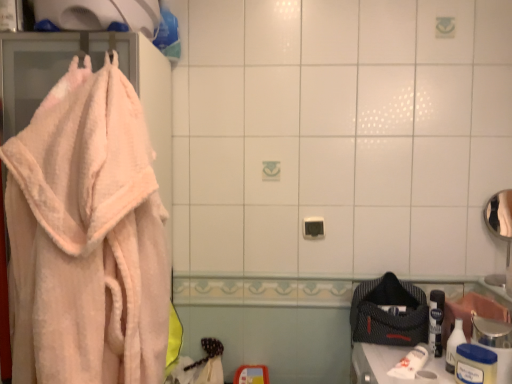
Question: Is peachy soft towel at left not inside white plastic container at lower right, which is the first toiletry from front to back?

Choices:
 (A) yes
 (B) no

Answer: (A)

Question: Is peachy soft towel at left thinner than white plastic container at lower right, which is the first toiletry from front to back?

Choices:
 (A) yes
 (B) no

Answer: (B)

Question: Is peachy soft towel at left at the right side of white plastic container at lower right, which is the first toiletry from front to back?

Choices:
 (A) yes
 (B) no

Answer: (B)

Question: Could you tell me if peachy soft towel at left is turned towards white plastic container at lower right, the 2th toiletry from the back?

Choices:
 (A) yes
 (B) no

Answer: (B)

Question: From the image's perspective, is peachy soft towel at left located beneath white plastic container at lower right, the 2th toiletry from the back?

Choices:
 (A) no
 (B) yes

Answer: (A)

Question: From the image's perspective, is peachy soft towel at left over white plastic container at lower right, the 2th toiletry from the back?

Choices:
 (A) yes
 (B) no

Answer: (A)

Question: Considering the relative positions of white matte toilet paper at lower right and white plastic container at lower right, the 2th toiletry from the back, in the image provided, is white matte toilet paper at lower right in front of white plastic container at lower right, the 2th toiletry from the back,?

Choices:
 (A) no
 (B) yes

Answer: (A)

Question: Would you say white matte toilet paper at lower right contains white plastic container at lower right, the 2th toiletry from the back?

Choices:
 (A) yes
 (B) no

Answer: (B)

Question: Considering the relative sizes of white matte toilet paper at lower right and white plastic container at lower right, the 2th toiletry from the back, in the image provided, is white matte toilet paper at lower right thinner than white plastic container at lower right, the 2th toiletry from the back,?

Choices:
 (A) no
 (B) yes

Answer: (A)

Question: Is white matte toilet paper at lower right not inside white plastic container at lower right, which is the first toiletry from front to back?

Choices:
 (A) yes
 (B) no

Answer: (A)

Question: Is white matte toilet paper at lower right at the right side of white plastic container at lower right, which is the first toiletry from front to back?

Choices:
 (A) no
 (B) yes

Answer: (A)

Question: Can you confirm if white matte toilet paper at lower right is positioned to the left of white plastic container at lower right, which is the first toiletry from front to back?

Choices:
 (A) no
 (B) yes

Answer: (B)

Question: Is white plastic bottle at lower right, the 1th toiletry when ordered from back to front, smaller than white plastic container at lower right, which is the first toiletry from front to back?

Choices:
 (A) no
 (B) yes

Answer: (B)